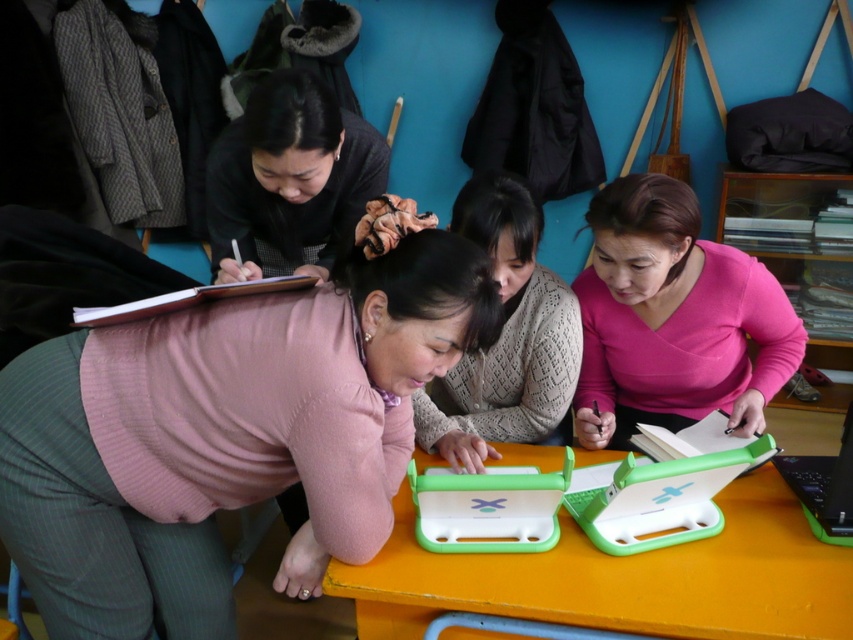
Question: Can you confirm if black matte hair clip at upper center is positioned above green plastic laptop at lower right?

Choices:
 (A) yes
 (B) no

Answer: (A)

Question: Which object appears farthest from the camera in this image?

Choices:
 (A) black matte hair clip at upper center
 (B) yellow plastic table at center
 (C) pink matte sweater at center

Answer: (C)

Question: Which point is closer to the camera taking this photo?

Choices:
 (A) (827, 512)
 (B) (772, 432)
 (C) (186, 528)
 (D) (753, 394)

Answer: (A)

Question: Is matte pink sweater at center wider than green plastic laptop at lower right?

Choices:
 (A) yes
 (B) no

Answer: (A)

Question: Is yellow plastic table at center positioned before matte pink sweater at center?

Choices:
 (A) no
 (B) yes

Answer: (B)

Question: Among these points, which one is nearest to the camera?

Choices:
 (A) (656, 248)
 (B) (485, 355)
 (C) (291, 376)
 (D) (838, 452)

Answer: (C)